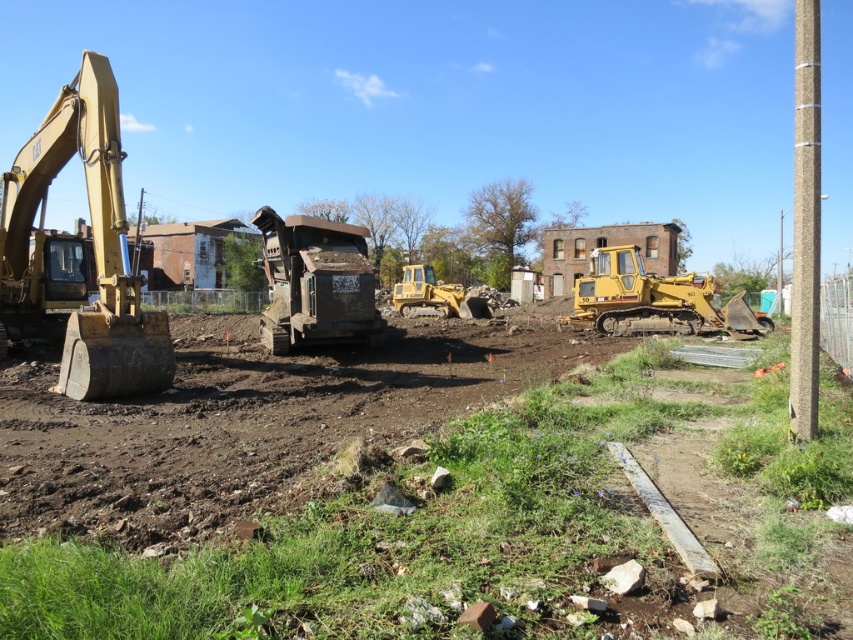
Does dirty metal dump truck at center have a lesser height compared to yellow rubber tracked excavator at center?

Yes, dirty metal dump truck at center is shorter than yellow rubber tracked excavator at center.

Which of these two, dirty metal dump truck at center or yellow rubber tracked excavator at center, stands taller?

yellow rubber tracked excavator at center is taller.

Image resolution: width=853 pixels, height=640 pixels. Identify the location of dirty metal dump truck at center. (316, 282).

Can you confirm if dirty metal dump truck at center is positioned to the right of brown textured pole at right?

Incorrect, dirty metal dump truck at center is not on the right side of brown textured pole at right.

Who is shorter, dirty metal dump truck at center or brown textured pole at right?

dirty metal dump truck at center is shorter.

This screenshot has height=640, width=853. Describe the element at coordinates (316, 282) in the screenshot. I see `dirty metal dump truck at center` at that location.

Image resolution: width=853 pixels, height=640 pixels. Identify the location of dirty metal dump truck at center. (316, 282).

Between point (792, 305) and point (689, 314), which one is positioned in front?

Positioned in front is point (792, 305).

Between brown textured pole at right and yellow rubber tracked excavator at center, which one appears on the left side from the viewer's perspective?

Positioned to the left is brown textured pole at right.

Is point (810, 296) farther from viewer compared to point (593, 292)?

No, it is not.

Find the location of a particular element. brown textured pole at right is located at coordinates (805, 225).